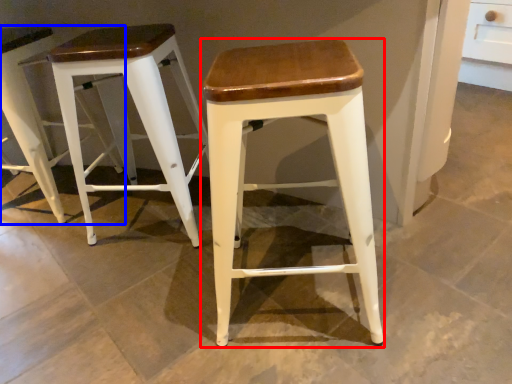
Question: Which object appears closest to the camera in this image, stool (highlighted by a red box) or stool (highlighted by a blue box)?

Choices:
 (A) stool
 (B) stool

Answer: (A)